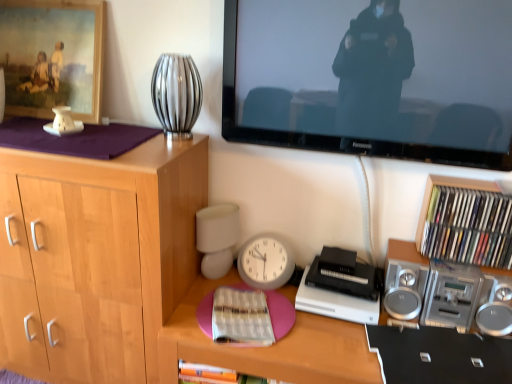
Question: Choose the correct answer: Is wooden framed painting at upper left inside white paper book at center, which is the first book from left to right, or outside it?

Choices:
 (A) outside
 (B) inside

Answer: (A)

Question: Considering the positions of wooden framed painting at upper left and white paper book at center, which is the first book from left to right, in the image, is wooden framed painting at upper left taller or shorter than white paper book at center, which is the first book from left to right,?

Choices:
 (A) short
 (B) tall

Answer: (B)

Question: Which of these objects is positioned farthest from the multicolored paper book at right, which is the 1th book in right-to-left order?

Choices:
 (A) silver metallic vase at upper center
 (B) pink matte desk at center
 (C) silver metallic stereo at right
 (D) light wood cabinet at left
 (E) white paper book at center, which is the first book from left to right

Answer: (D)

Question: Estimate the real-world distances between objects in this image. Which object is closer to the wooden framed painting at upper left?

Choices:
 (A) silver metallic vase at upper center
 (B) white paper book at center, acting as the 1th book starting from the bottom
 (C) silver metallic stereo at right
 (D) pink matte desk at center
 (E) light wood cabinet at left

Answer: (A)